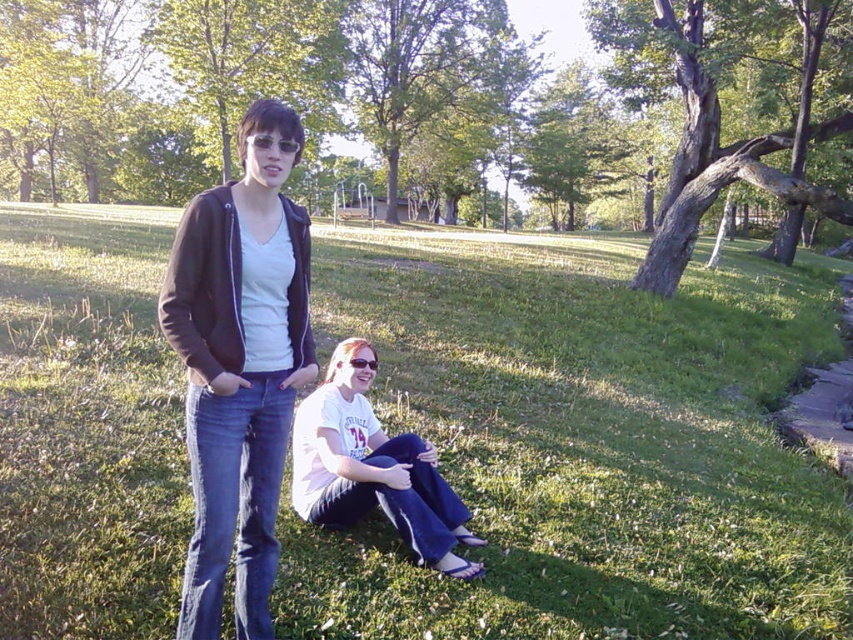
Question: Is matte black jacket at center bigger than white cotton shirt at lower center?

Choices:
 (A) yes
 (B) no

Answer: (A)

Question: Among these points, which one is nearest to the camera?

Choices:
 (A) (351, 429)
 (B) (126, 244)

Answer: (A)

Question: Which point is farther from the camera taking this photo?

Choices:
 (A) (219, 522)
 (B) (320, 428)
 (C) (753, 298)

Answer: (C)

Question: Does green grass at center appear under white cotton shirt at lower center?

Choices:
 (A) yes
 (B) no

Answer: (B)

Question: Does green grass at center have a lesser width compared to matte black jacket at center?

Choices:
 (A) no
 (B) yes

Answer: (A)

Question: Among these points, which one is nearest to the camera?

Choices:
 (A) click(x=273, y=529)
 (B) click(x=396, y=513)

Answer: (A)